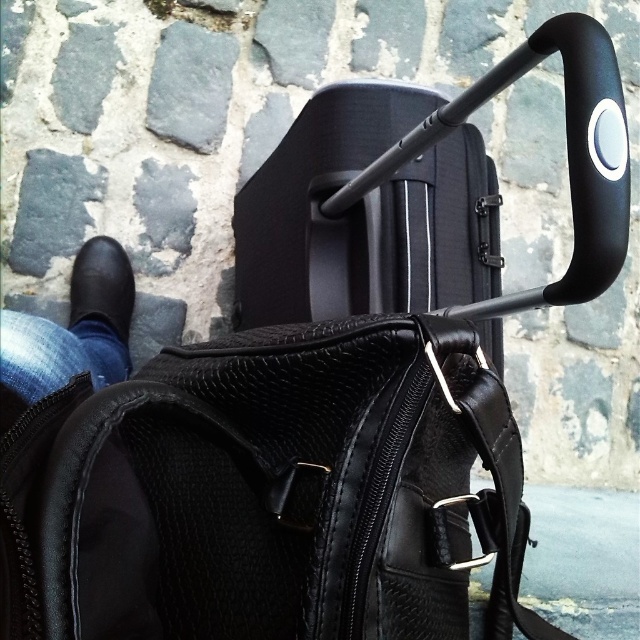
At what (x,y) coordinates should I click in order to perform the action: click on matte black suitcase at upper center. Please return your answer as a coordinate pair (x, y). The width and height of the screenshot is (640, 640). Looking at the image, I should click on (426, 195).

Which of these two, matte black suitcase at upper center or black leather shoe at lower left, stands taller?

matte black suitcase at upper center

Does point (465, 173) come farther from viewer compared to point (99, 253)?

No, it is in front of (99, 253).

The height and width of the screenshot is (640, 640). In order to click on matte black suitcase at upper center in this screenshot , I will do `click(426, 195)`.

Between black leather bag at center and matte black suitcase at upper center, which one is positioned higher?

matte black suitcase at upper center is higher up.

Between point (349, 342) and point (408, 148), which one is positioned behind?

Positioned behind is point (408, 148).

Who is more forward, (484, 442) or (490, 250)?

Point (484, 442) is more forward.

Find the location of `black leather bag at center`. black leather bag at center is located at coordinates (273, 492).

Is black leather bag at center to the left of black leather shoe at lower left from the viewer's perspective?

No, black leather bag at center is not to the left of black leather shoe at lower left.

Can you confirm if black leather bag at center is smaller than black leather shoe at lower left?

Incorrect, black leather bag at center is not smaller in size than black leather shoe at lower left.

Describe the element at coordinates (273, 492) in the screenshot. This screenshot has width=640, height=640. I see `black leather bag at center` at that location.

I want to click on black leather bag at center, so click(x=273, y=492).